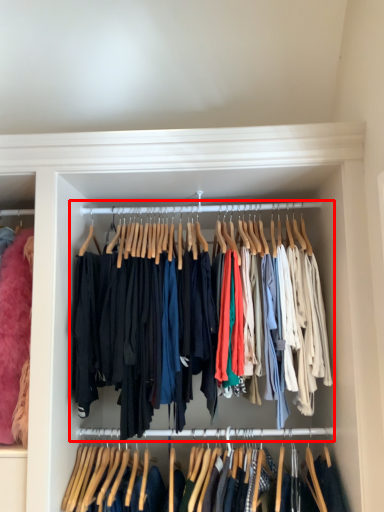
Question: In this image, where is closet (annotated by the red box) located relative to closet?

Choices:
 (A) right
 (B) left

Answer: (B)